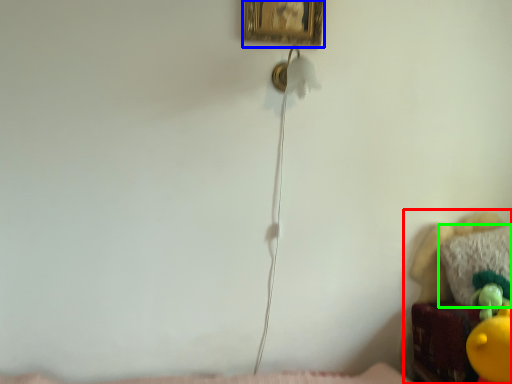
Question: Which object is positioned farthest from furniture (highlighted by a red box)? Select from picture frame (highlighted by a blue box) and pillow (highlighted by a green box).

Choices:
 (A) picture frame
 (B) pillow

Answer: (A)